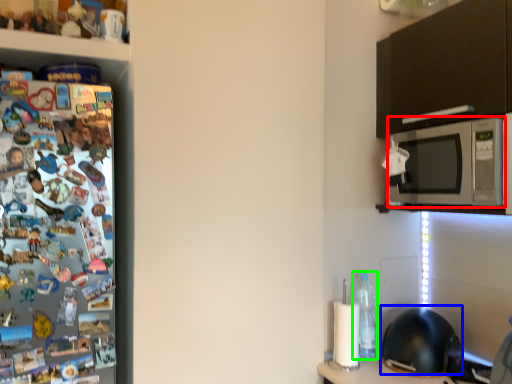
Question: Based on their relative distances, which object is nearer to microwave oven (highlighted by a red box)? Choose from helmet (highlighted by a blue box) and bottle (highlighted by a green box).

Choices:
 (A) helmet
 (B) bottle

Answer: (B)